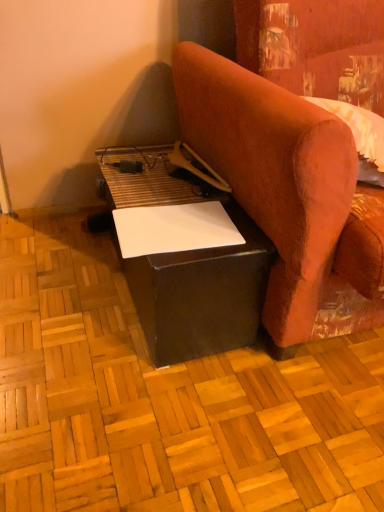
The height and width of the screenshot is (512, 384). What are the coordinates of `free space in front of black matte table at lower center` in the screenshot? It's located at (160, 410).